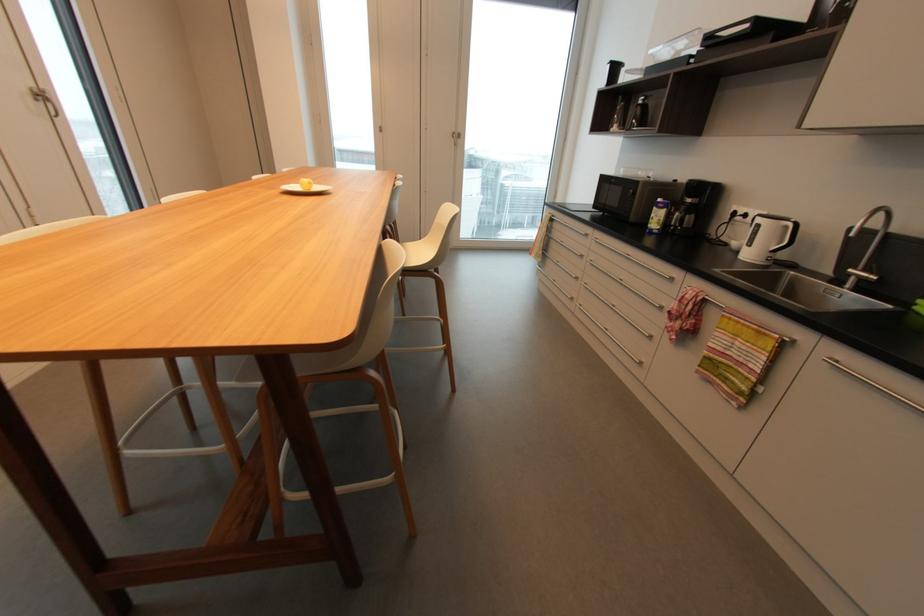
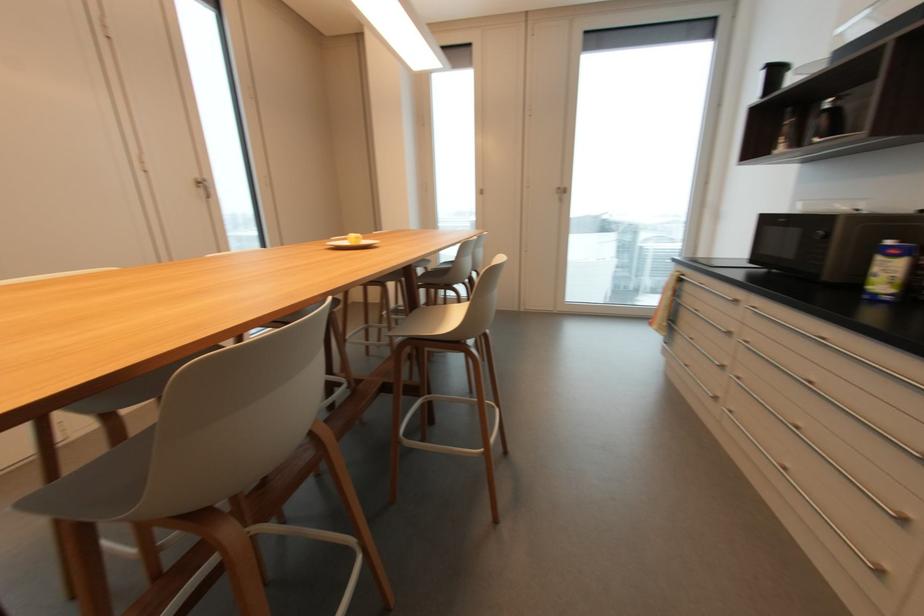
Question: The camera is either moving clockwise (left) or counter-clockwise (right) around the object. The first image is from the beginning of the video and the second image is from the end. Is the camera moving left or right when shooting the video?

Choices:
 (A) Left
 (B) Right

Answer: (B)